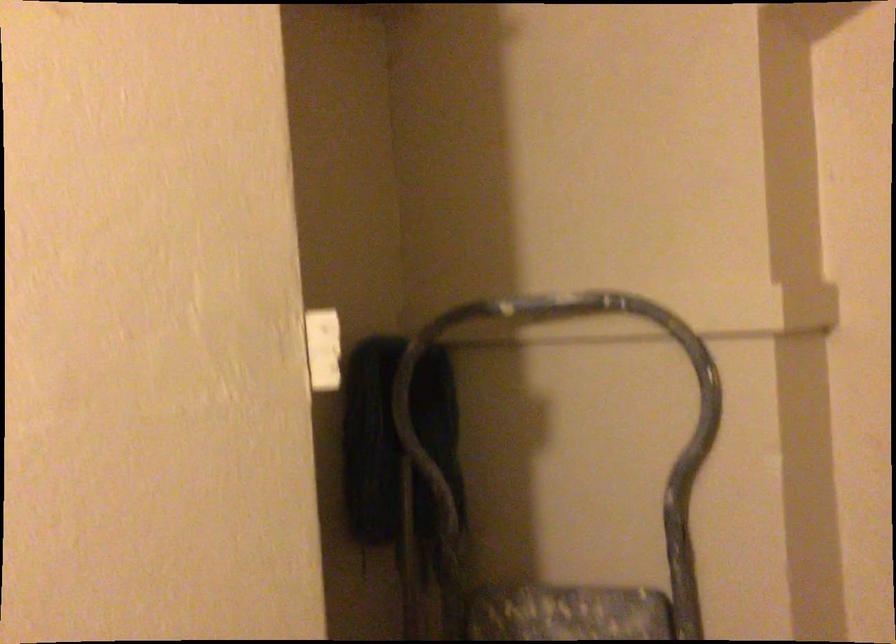
Describe the element at coordinates (684, 536) in the screenshot. I see `the ladder step` at that location.